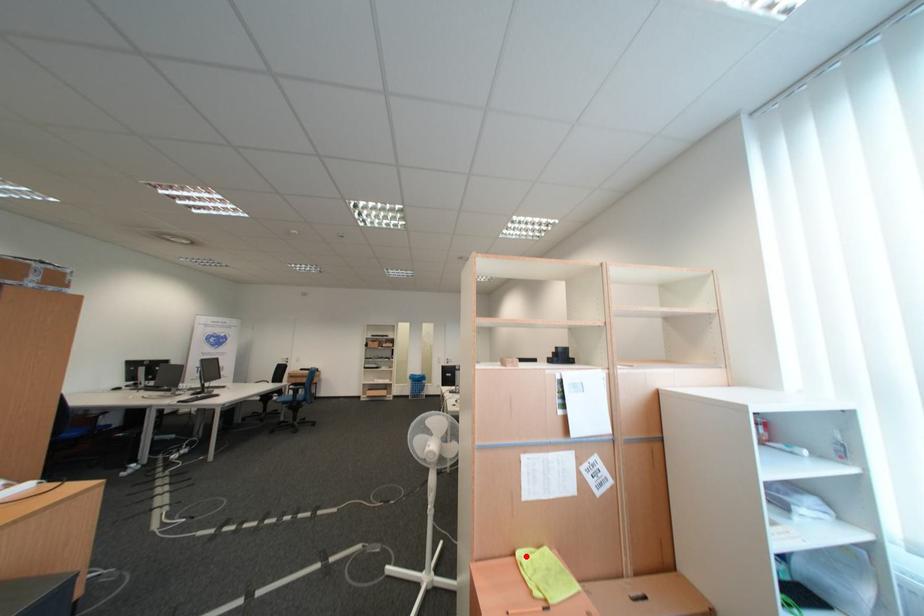
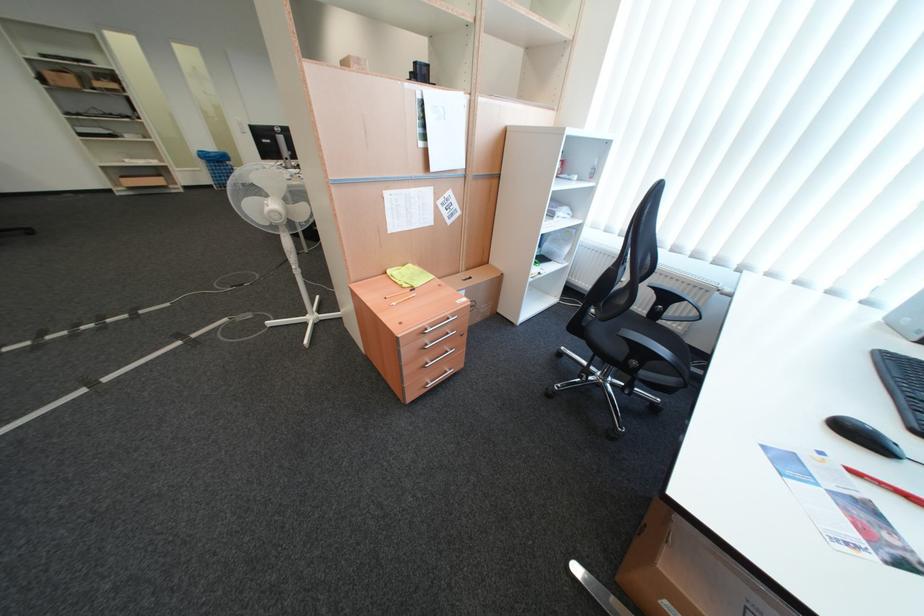
In the second image, find the point that corresponds to the highlighted location in the first image.

(397, 274)